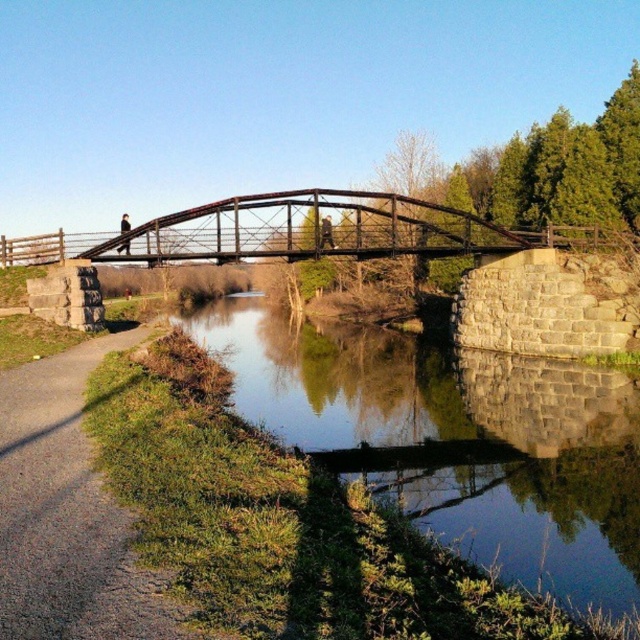
You are planning to walk from the gravel path at lower left to the smooth concrete water at center. Considering their widths, which path would allow you to walk faster? Please explain your reasoning based on their widths.

The smooth concrete water at center is wider than the gravel path at lower left. Since wider paths generally allow for faster movement due to more space, you can walk faster on the smooth concrete water at center.

You are planning to walk from the gravel path at lower left to the smooth concrete water at center. Which surface will you step on first?

You will step on the gravel path at lower left first because it is your starting point before reaching the smooth concrete water at center.